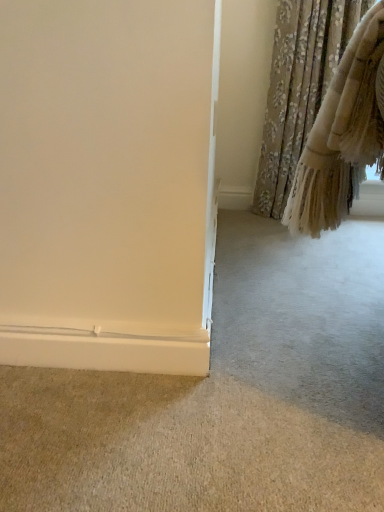
Find the location of a particular element. The image size is (384, 512). floral fabric curtain at upper right is located at coordinates (299, 88).

What do you see at coordinates (299, 88) in the screenshot? The height and width of the screenshot is (512, 384). I see `floral fabric curtain at upper right` at bounding box center [299, 88].

I want to click on floral fabric curtain at upper right, so click(299, 88).